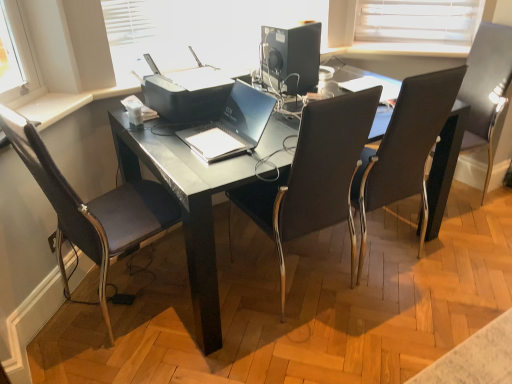
The height and width of the screenshot is (384, 512). What are the coordinates of `free region under dark brown leather chair at left, positioned as the 1th chair in left-to-right order (from a real-world perspective)` in the screenshot? It's located at pyautogui.click(x=120, y=297).